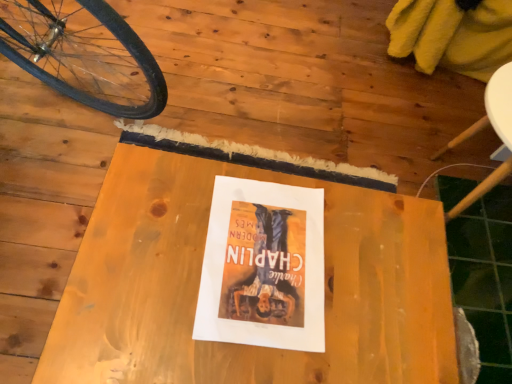
The image size is (512, 384). In order to click on vacant space to the right of white paper at center in this screenshot , I will do `click(377, 281)`.